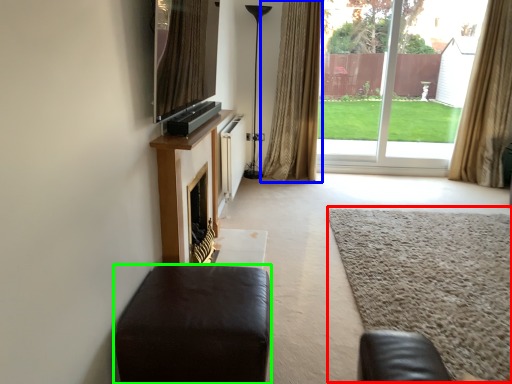
Question: Which object is the closest to the plain (highlighted by a red box)? Choose among these: curtain (highlighted by a blue box) or furniture (highlighted by a green box).

Choices:
 (A) curtain
 (B) furniture

Answer: (B)